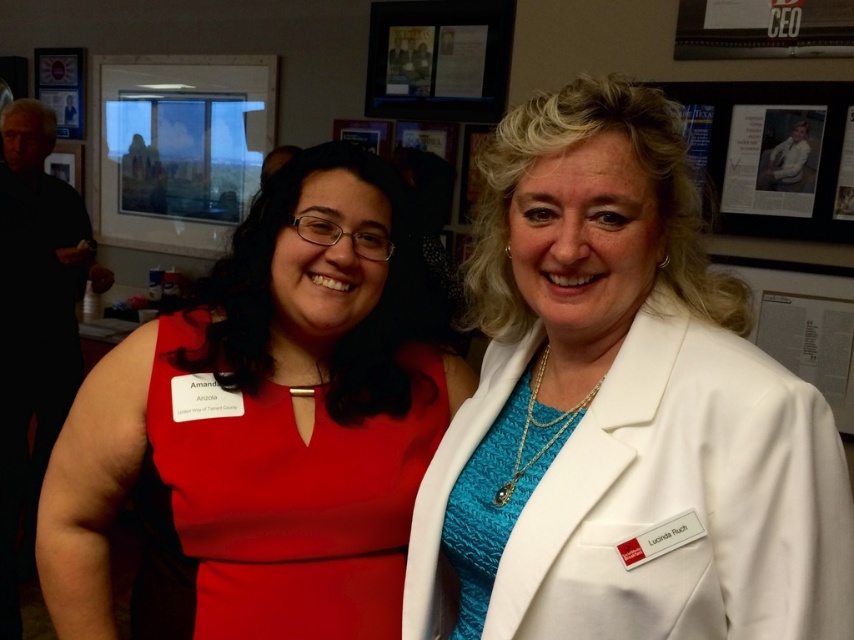
Looking at this image, you are standing in the room and want to take a photo of the satin red dress at left. Where should you position yourself to capture it in the frame?

The satin red dress at left is located at point (x=268, y=417), so you should position yourself to the left side of the frame to capture it.

You are a photographer setting up for a group photo. You need to ensure that the satin red dress at center and the metallic poster at upper left are both in focus. Which object should you adjust your camera focus to prioritize for sharpness first?

The satin red dress at center is closer to the viewer than the metallic poster at upper left. To ensure both are in focus, prioritize focusing on the satin red dress at center first, as it is closer, and the poster will fall into the depth of field range when focused on the dress.